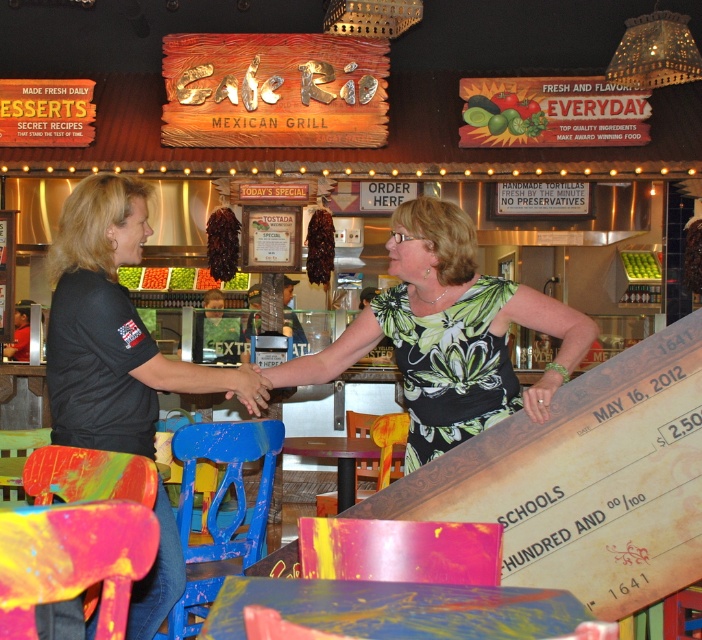
You are a customer at Cafe Rio Mexican Grill and want to know which of the two people is closer to the entrance. The two people are the green floral dress at center and the black matte shirt at left. Based on their positions, which one is closer to the entrance?

The green floral dress at center is closer to the entrance because it is positioned at the center of the scene, while the black matte shirt at left is located further back on the left side.

Where is the green floral dress at center located in the image?

The green floral dress at center is located at point (449, 333) in the image.